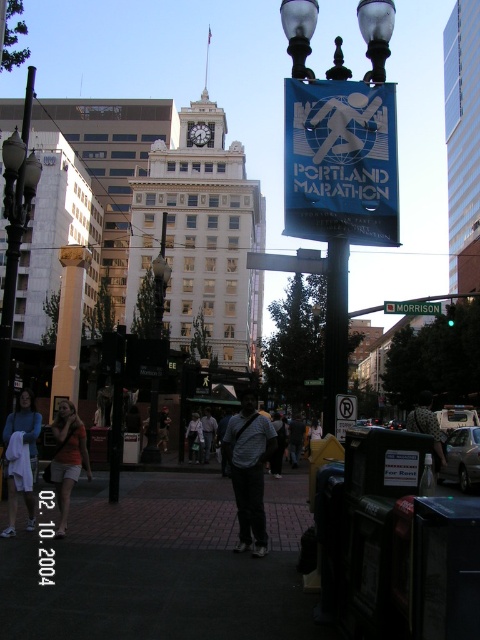
You are standing at the center of the sidewalk in the urban street scene. You need to locate the metallic pole at right. According to the coordinates provided, where should you look relative to your position?

The metallic pole at right is located at coordinates point 0.514 on the x axis and 0.700 on the y axis relative to the image frame. Since you are at the center of the sidewalk, you should look towards the right side of the image where the pole is positioned at those coordinates.

You are a delivery person standing on the dark brick pavement at center and need to deliver a package to the dark gray fabric shirt at center. Can you hand over the package without moving from your current position?

The distance between the dark brick pavement at center and the dark gray fabric shirt at center is 27.92 meters, so you cannot hand over the package without moving closer.